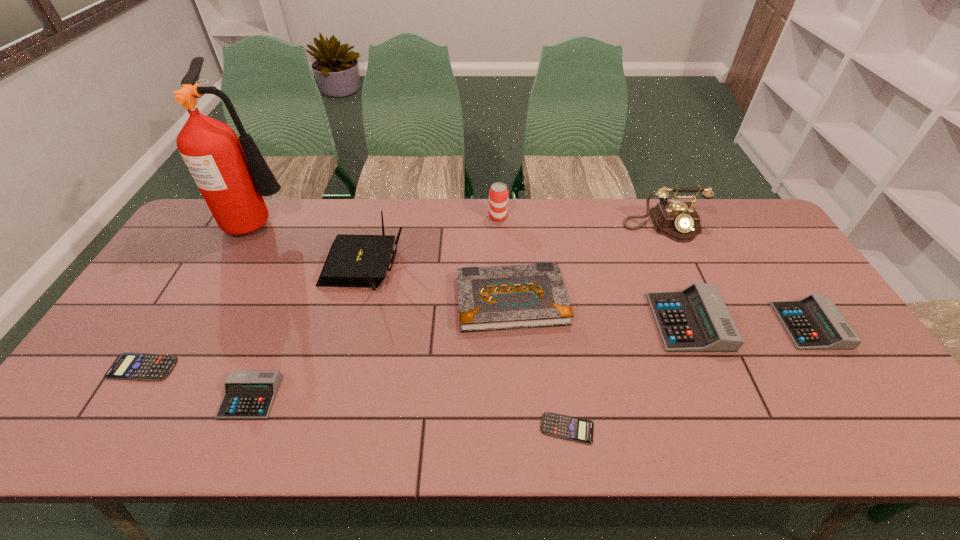
Locate an element on the screen. The height and width of the screenshot is (540, 960). beer can situated at the far edge is located at coordinates (498, 194).

Where is `router present at the far edge`? Image resolution: width=960 pixels, height=540 pixels. router present at the far edge is located at coordinates (353, 260).

You are a GUI agent. You are given a task and a screenshot of the screen. Output one action in this format:
    pyautogui.click(x=<x>, y=<y>)
    Task: Click on the fire extinguisher located in the left edge section of the desktop
    Image resolution: width=960 pixels, height=540 pixels.
    Given the screenshot: What is the action you would take?
    pyautogui.click(x=232, y=175)

Identify the location of calculator positioned at the left edge. This screenshot has height=540, width=960. (128, 366).

Identify the location of object present at the right edge. (814, 322).

The width and height of the screenshot is (960, 540). Identify the location of object situated at the far left corner. (232, 175).

The width and height of the screenshot is (960, 540). In the image, there is a desktop. In order to click on blank space at the far edge in this screenshot , I will do `click(572, 227)`.

What are the coordinates of `vacant space at the near edge of the desktop` in the screenshot? It's located at (685, 442).

I want to click on vacant region at the right edge of the desktop, so click(x=872, y=382).

The width and height of the screenshot is (960, 540). Identify the location of vacant space at the far left corner of the desktop. (196, 241).